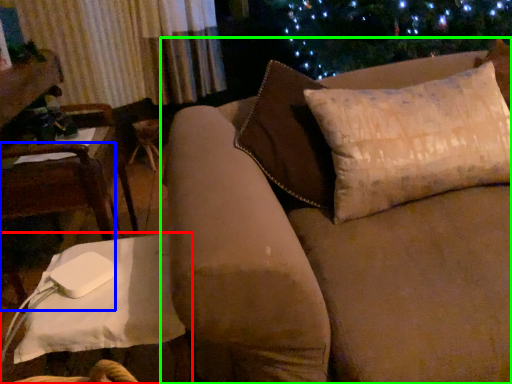
Question: Based on their relative distances, which object is farther from table (highlighted by a red box)? Choose from chair (highlighted by a blue box) and studio couch (highlighted by a green box).

Choices:
 (A) chair
 (B) studio couch

Answer: (A)